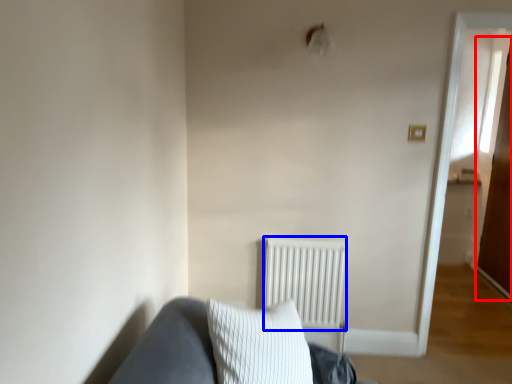
Question: Which of the following is the closest to the observer, glass door (highlighted by a red box) or radiator (highlighted by a blue box)?

Choices:
 (A) glass door
 (B) radiator

Answer: (B)